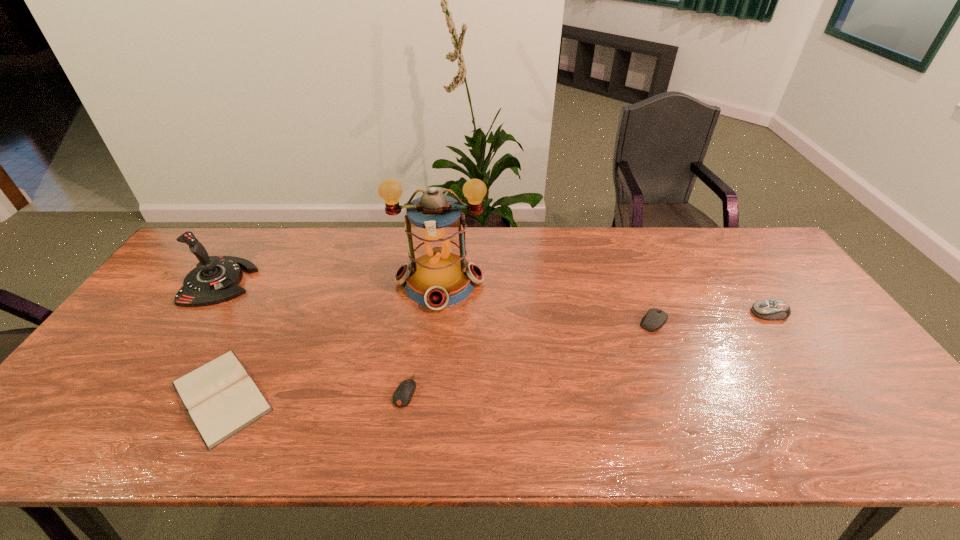
Locate an element on the screen. This screenshot has width=960, height=540. vacant region located 0.380m on the wheel side of the tallest computer mouse is located at coordinates (618, 313).

Find the location of a particular element. The height and width of the screenshot is (540, 960). free space located 0.240m on the wheel side of the tallest computer mouse is located at coordinates (668, 313).

Locate an element on the screen. This screenshot has height=540, width=960. vacant space positioned on the back of the second computer mouse from right to left is located at coordinates (622, 244).

Locate an element on the screen. vacant space located 0.060m on the back of the nearest computer mouse is located at coordinates (411, 355).

Locate an element on the screen. This screenshot has height=540, width=960. free spot located 0.180m on the left of the Bible is located at coordinates (88, 396).

At what (x,y) coordinates should I click in order to perform the action: click on lantern that is at the far edge. Please return your answer as a coordinate pair (x, y). Image resolution: width=960 pixels, height=540 pixels. Looking at the image, I should click on (439, 275).

Find the location of a particular element. Image resolution: width=960 pixels, height=540 pixels. joystick at the far edge is located at coordinates 215,279.

Identify the location of object that is at the near edge. This screenshot has height=540, width=960. (221, 398).

Find the location of a particular element. Image resolution: width=960 pixels, height=540 pixels. object present at the left edge is located at coordinates (215, 279).

Identify the location of object present at the right edge. (766, 309).